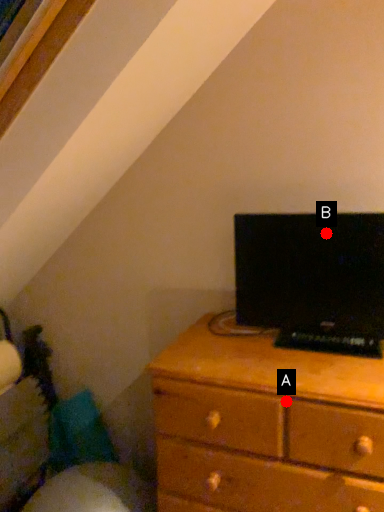
Question: Two points are circled on the image, labeled by A and B beside each circle. Which point is farther from the camera taking this photo?

Choices:
 (A) A is further
 (B) B is further

Answer: (B)